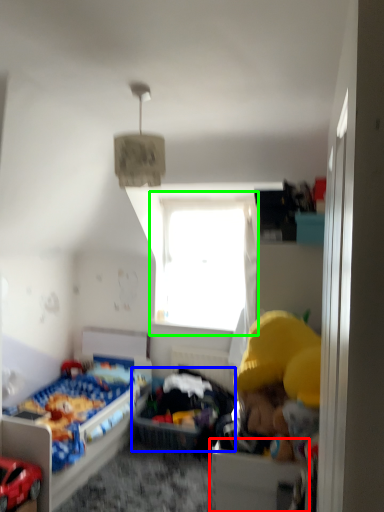
Question: Based on their relative distances, which object is nearer to drawer (highlighted by a red box)? Choose from infant bed (highlighted by a blue box) and window (highlighted by a green box).

Choices:
 (A) infant bed
 (B) window

Answer: (A)